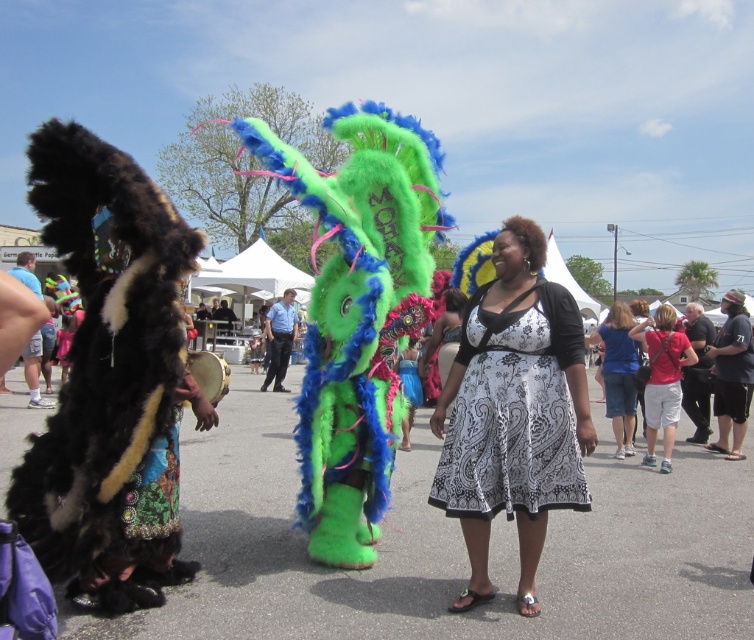
You are attending a cultural festival and see two people wearing the white printed dress at center and the black cotton shirt at right. Which one is positioned higher from the ground?

The white printed dress at center is above the black cotton shirt at right, so the person wearing the white printed dress at center is positioned higher from the ground.

You are an event photographer at the festival. You need to capture a photo of both the white printed dress at center and the black cotton shirt at right in the same frame. Based on their positions, which one should you focus on first to ensure both are in the shot?

The white printed dress at center is to the left of the black cotton shirt at right, so you should focus on the black cotton shirt at right first to ensure both are in the shot.

You are a photographer at the event and want to capture both the white cotton shorts at lower right and the red cotton shirt at right in a single frame. Which object should you focus on first to ensure both are in the frame?

The white cotton shorts at lower right is taller than the red cotton shirt at right, so you should focus on the white cotton shorts at lower right first to ensure both are in the frame.